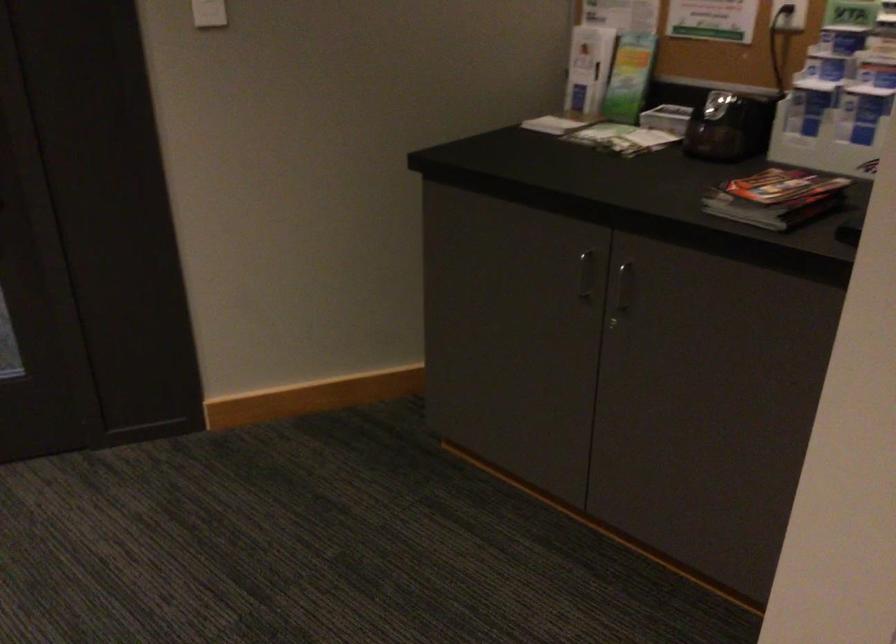
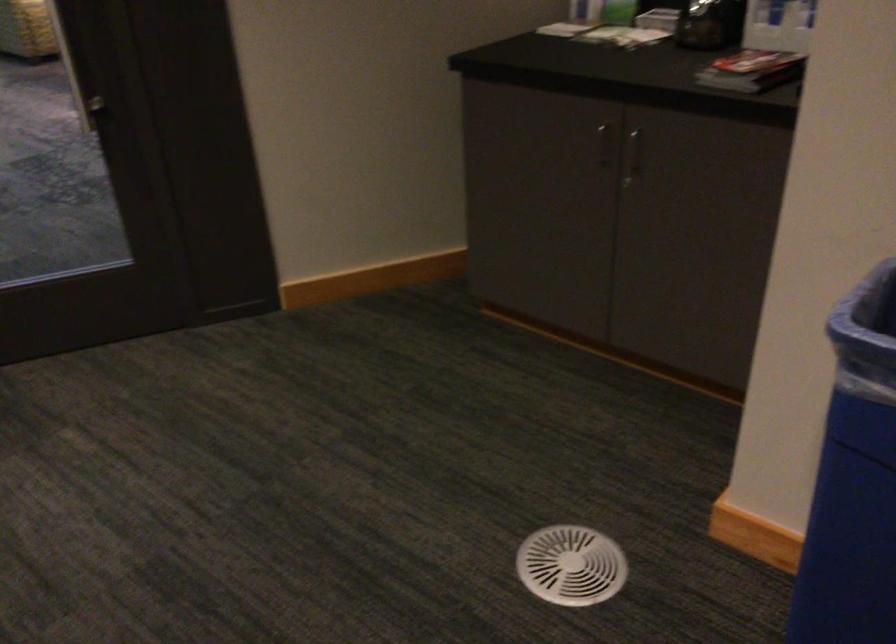
Question: The images are taken continuously from a first-person perspective. In which direction is your viewpoint rotating?

Choices:
 (A) Left
 (B) Right
 (C) Up
 (D) Down

Answer: (D)